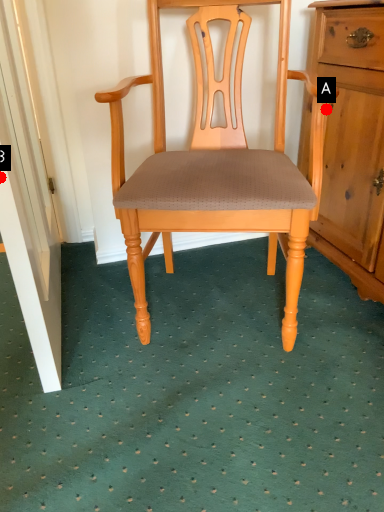
Question: Two points are circled on the image, labeled by A and B beside each circle. Which of the following is the farthest from the observer?

Choices:
 (A) A is further
 (B) B is further

Answer: (A)